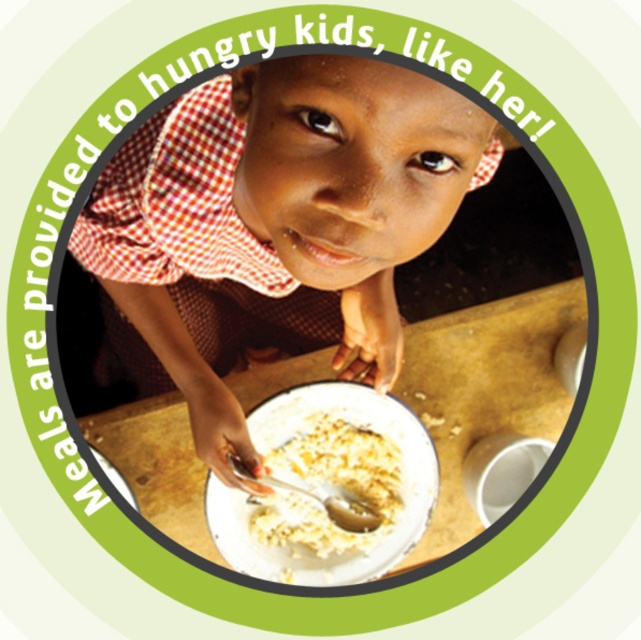
What is the exact location of the matte brown shirt at center within the image?

The matte brown shirt at center is located at point (272, 227).

You are a volunteer at a food distribution center and need to ensure that the white glossy plate at center and the white matte porridge at center are placed correctly on the table for the child. According to the image, which object is closer to the child?

The white glossy plate at center is closer to the child because it is positioned further to the viewer than the white matte porridge at center, indicating it is nearer in the scene.

You are a volunteer at a community kitchen distributing meals. You see a child wearing a matte brown shirt at center eating from a white glossy plate at center. Can you confirm if the shirt is covering the plate?

The matte brown shirt at center is positioned over the white glossy plate at center, so yes, the shirt is covering the plate.